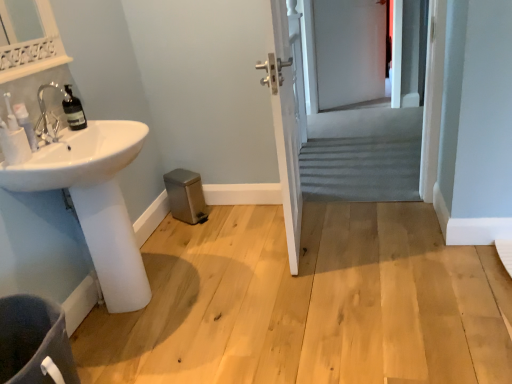
In order to click on blank area beneath white glossy sink at lower left (from a real-world perspective) in this screenshot , I will do `click(145, 300)`.